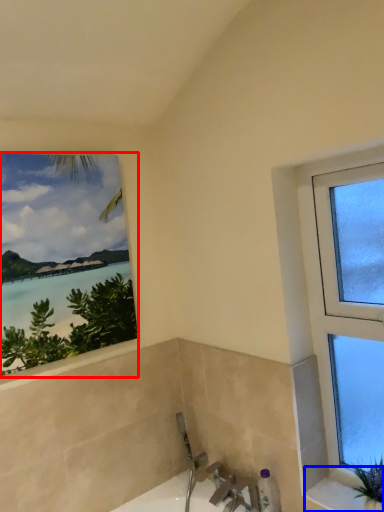
Question: Which object is further to the camera taking this photo, window (highlighted by a red box) or window sill (highlighted by a blue box)?

Choices:
 (A) window
 (B) window sill

Answer: (A)